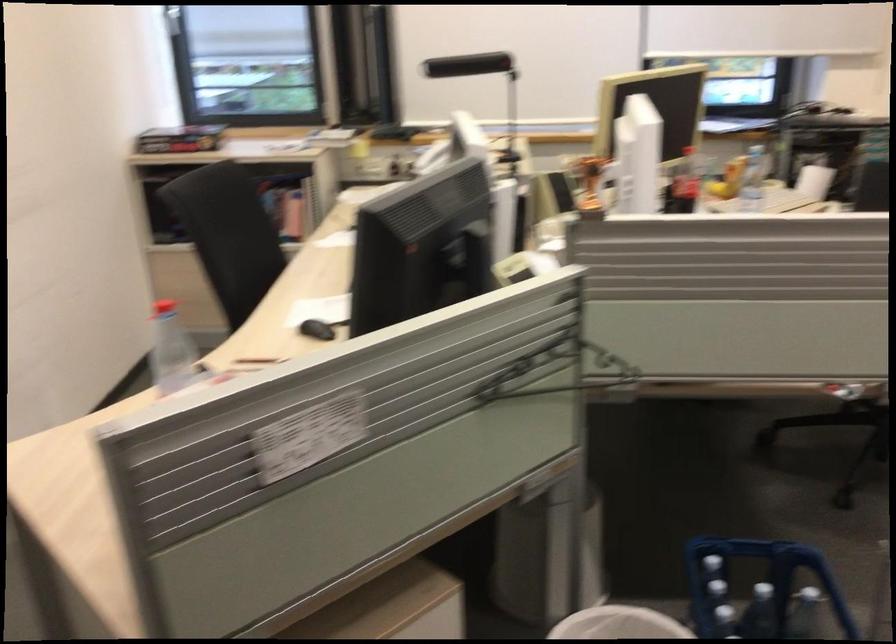
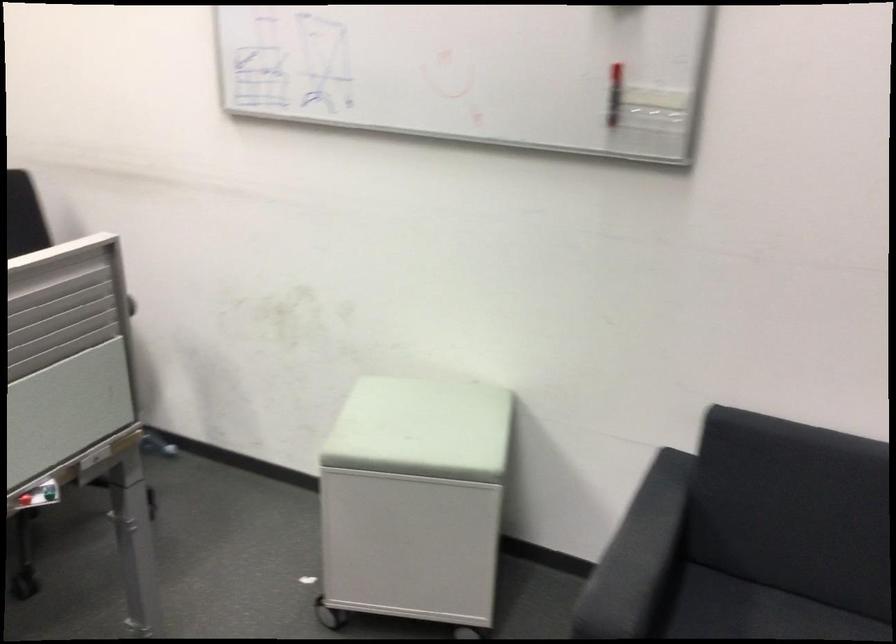
Question: The images are taken continuously from a first-person perspective. In which direction is your viewpoint rotating?

Choices:
 (A) Left
 (B) Right
 (C) Up
 (D) Down

Answer: (B)